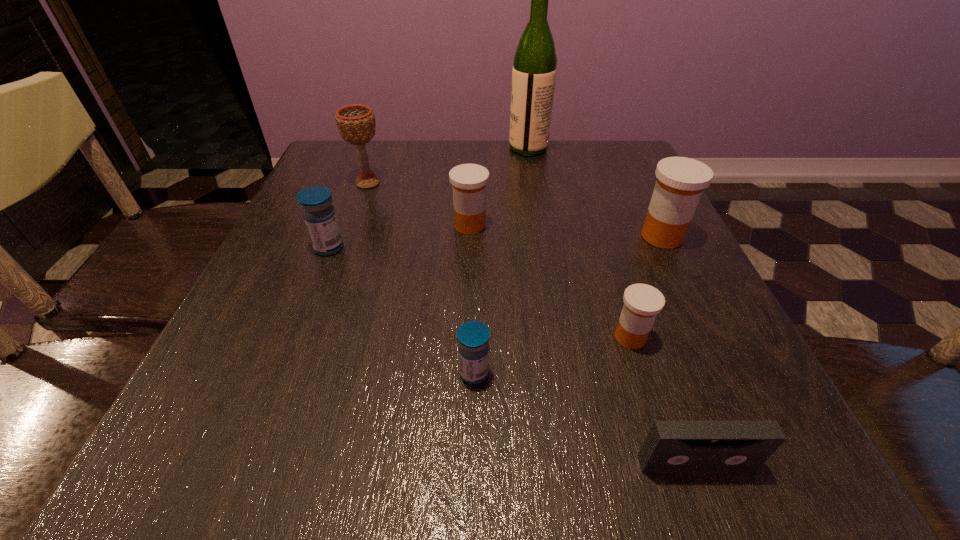
Choose which object is the fourth nearest neighbor to the seventh farthest object. Please provide its 2D coordinates. Your answer should be formatted as a tuple, i.e. [(x, y)], where the tuple contains the x and y coordinates of a point satisfying the conditions above.

[(319, 215)]

In order to click on the seventh closest object relative to the videotape in this screenshot , I will do `click(534, 69)`.

Where is `medicine that is the fourth nearest to the leftmost orange medicine`? This screenshot has width=960, height=540. medicine that is the fourth nearest to the leftmost orange medicine is located at coordinates (473, 337).

Point out which medicine is positioned as the fifth nearest to the farthest object. Please provide its 2D coordinates. Your answer should be formatted as a tuple, i.e. [(x, y)], where the tuple contains the x and y coordinates of a point satisfying the conditions above.

[(473, 337)]

Find the location of `the closest orange medicine to the tallest object`. the closest orange medicine to the tallest object is located at coordinates (468, 181).

Select which orange medicine is the second closest to the nearest object. Please provide its 2D coordinates. Your answer should be formatted as a tuple, i.e. [(x, y)], where the tuple contains the x and y coordinates of a point satisfying the conditions above.

[(680, 182)]

You are a GUI agent. You are given a task and a screenshot of the screen. Output one action in this format:
    pyautogui.click(x=<x>, y=<y>)
    Task: Click on the blank area in the image that satisfies the following two spatial constraints: 1. on the front side of the smaller blue medicine; 2. on the right side of the beige chalice
    This screenshot has height=540, width=960.
    Given the screenshot: What is the action you would take?
    pyautogui.click(x=300, y=373)

This screenshot has height=540, width=960. I want to click on free location that satisfies the following two spatial constraints: 1. on the label of the fourth object from right to left; 2. on the front side of the second farthest object, so click(535, 183).

Find the location of `vacant space that satisfies the following two spatial constraints: 1. on the label of the leftmost orange medicine; 2. on the right side of the right blue medicine`. vacant space that satisfies the following two spatial constraints: 1. on the label of the leftmost orange medicine; 2. on the right side of the right blue medicine is located at coordinates [x=466, y=373].

At what (x,y) coordinates should I click in order to perform the action: click on vacant position in the image that satisfies the following two spatial constraints: 1. on the label of the nearest medicine; 2. on the right side of the second biggest orange medicine. Please return your answer as a coordinate pair (x, y). Looking at the image, I should click on (466, 373).